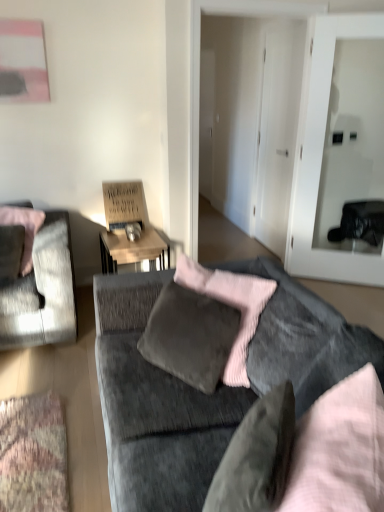
What do you see at coordinates (42, 291) in the screenshot? I see `velvet grey chair at left` at bounding box center [42, 291].

Image resolution: width=384 pixels, height=512 pixels. What do you see at coordinates (256, 457) in the screenshot?
I see `velvet gray pillow at center, which is the 1th pillow in bottom-to-top order` at bounding box center [256, 457].

I want to click on wooden desk at center, so click(x=131, y=249).

Is wooden desk at center looking in the opposite direction of velvet gray couch at center?

No, wooden desk at center is not facing the opposite direction of velvet gray couch at center.

Does point (119, 238) lie behind point (204, 411)?

Yes.

Is wooden desk at center not near velvet gray couch at center?

wooden desk at center is positioned a significant distance from velvet gray couch at center.

In the scene shown: From a real-world perspective, is wooden desk at center physically located above or below velvet gray pillow at center, acting as the first pillow starting from the right?

In terms of real-world spatial position, wooden desk at center is below velvet gray pillow at center, acting as the first pillow starting from the right.

Considering their positions, is wooden desk at center located in front of or behind velvet gray pillow at center, which is counted as the second pillow, starting from the left?

wooden desk at center is positioned farther from the viewer than velvet gray pillow at center, which is counted as the second pillow, starting from the left.

Is wooden desk at center far from velvet gray pillow at center, which is counted as the second pillow, starting from the left?

Yes.

What's the angular difference between velvet gray pillow at center, which is counted as the second pillow, starting from the left, and wooden desk at center's facing directions?

The angle between the facing direction of velvet gray pillow at center, which is counted as the second pillow, starting from the left, and the facing direction of wooden desk at center is 132 degrees.

Considering the relative sizes of velvet gray pillow at center, which appears as the second pillow when viewed from the back, and wooden desk at center in the image provided, is velvet gray pillow at center, which appears as the second pillow when viewed from the back, thinner than wooden desk at center?

Yes.

From a real-world perspective, which is physically above, velvet gray pillow at center, which is the 1th pillow in bottom-to-top order, or wooden desk at center?

In real-world perspective, velvet gray pillow at center, which is the 1th pillow in bottom-to-top order, is above.

Which is more to the left, velvet gray pillow at center, which ranks as the 1th pillow in front-to-back order, or wooden desk at center?

From the viewer's perspective, wooden desk at center appears more on the left side.

What's the angular difference between wooden desk at center and pink velvet pillow at left, arranged as the 2th pillow when viewed from the front,'s facing directions?

The angle between the facing direction of wooden desk at center and the facing direction of pink velvet pillow at left, arranged as the 2th pillow when viewed from the front, is 23.6 degrees.

From a real-world perspective, is wooden desk at center beneath pink velvet pillow at left, which ranks as the first pillow in top-to-bottom order?

Yes.

Find the location of a particular element. This screenshot has height=512, width=384. the 1st pillow in front of the wooden desk at center is located at coordinates (25, 229).

From the picture: Considering the relative positions of wooden desk at center and pink velvet pillow at left, which ranks as the first pillow in top-to-bottom order, in the image provided, is wooden desk at center to the right of pink velvet pillow at left, which ranks as the first pillow in top-to-bottom order, from the viewer's perspective?

Correct, you'll find wooden desk at center to the right of pink velvet pillow at left, which ranks as the first pillow in top-to-bottom order.

Is velvet gray pillow at center, acting as the first pillow starting from the right, oriented towards transparent glass door at center right?

No, velvet gray pillow at center, acting as the first pillow starting from the right, does not turn towards transparent glass door at center right.

How many degrees apart are the facing directions of velvet gray pillow at center, which is counted as the second pillow, starting from the left, and transparent glass door at center right?

The facing directions of velvet gray pillow at center, which is counted as the second pillow, starting from the left, and transparent glass door at center right are 97.8 degrees apart.

From a real-world perspective, is velvet gray pillow at center, acting as the first pillow starting from the right, below transparent glass door at center right?

Yes, from a real-world perspective, velvet gray pillow at center, acting as the first pillow starting from the right, is below transparent glass door at center right.

Which object is positioned more to the left, velvet gray pillow at center, acting as the first pillow starting from the right, or transparent glass door at center right?

velvet gray pillow at center, acting as the first pillow starting from the right, is more to the left.

How much distance is there between velvet gray couch at center and transparent glass door at center right?

velvet gray couch at center and transparent glass door at center right are 6.75 feet apart from each other.

Is velvet gray couch at center at the right side of transparent glass door at center right?

Incorrect, velvet gray couch at center is not on the right side of transparent glass door at center right.

Are velvet gray couch at center and transparent glass door at center right making contact?

No, velvet gray couch at center is not making contact with transparent glass door at center right.

Looking at this image, is velvet gray couch at center bigger than transparent glass door at center right?

Correct, velvet gray couch at center is larger in size than transparent glass door at center right.

From the image's perspective, which object appears higher, pink velvet pillow at left, placed as the first pillow when sorted from left to right, or velvet gray pillow at center, which ranks as the 1th pillow in front-to-back order?

pink velvet pillow at left, placed as the first pillow when sorted from left to right.

Is pink velvet pillow at left, which appears as the 2th pillow when ordered from the bottom, wider than velvet gray pillow at center, which is the 1th pillow in bottom-to-top order?

No.

From a real-world perspective, is pink velvet pillow at left, which ranks as the 1th pillow in back-to-front order, located higher than velvet gray pillow at center, acting as the first pillow starting from the right?

Result: Yes.

Is pink velvet pillow at left, which appears as the 2th pillow when ordered from the bottom, inside or outside of velvet gray pillow at center, which ranks as the 1th pillow in front-to-back order?

pink velvet pillow at left, which appears as the 2th pillow when ordered from the bottom, is not enclosed by velvet gray pillow at center, which ranks as the 1th pillow in front-to-back order.

Where is `studio couch on the right of wooden desk at center`? The height and width of the screenshot is (512, 384). studio couch on the right of wooden desk at center is located at coordinates (201, 392).

You are a GUI agent. You are given a task and a screenshot of the screen. Output one action in this format:
    pyautogui.click(x=<x>, y=<y>)
    Task: Click on the desk above the velvet gray pillow at center, acting as the first pillow starting from the right (from the image's perspective)
    
    Given the screenshot: What is the action you would take?
    pyautogui.click(x=131, y=249)

In the scene shown: Based on their spatial positions, is velvet grey chair at left or transparent glass door at center right closer to pink velvet pillow at left, which appears as the 2th pillow when ordered from the bottom?

velvet grey chair at left lies closer to pink velvet pillow at left, which appears as the 2th pillow when ordered from the bottom, than the other object.

Estimate the real-world distances between objects in this image. Which object is further from velvet grey chair at left, velvet gray couch at center or wooden desk at center?

The object further to velvet grey chair at left is velvet gray couch at center.

Which object lies further to the anchor point velvet grey chair at left, transparent glass door at center right or wooden desk at center?

The object further to velvet grey chair at left is transparent glass door at center right.

Looking at the image, which one is located closer to wooden desk at center, transparent glass door at center right or velvet grey chair at left?

The object closer to wooden desk at center is velvet grey chair at left.

Based on the photo, considering their positions, is wooden desk at center positioned further to velvet gray couch at center than transparent glass door at center right?

transparent glass door at center right is further to velvet gray couch at center.

Estimate the real-world distances between objects in this image. Which object is further from transparent glass door at center right, velvet grey chair at left or wooden desk at center?

velvet grey chair at left.

Which object lies nearer to the anchor point pink velvet pillow at left, which appears as the 2th pillow when ordered from the bottom, transparent glass door at center right or velvet gray pillow at center, which ranks as the 1th pillow in front-to-back order?

velvet gray pillow at center, which ranks as the 1th pillow in front-to-back order, is closer to pink velvet pillow at left, which appears as the 2th pillow when ordered from the bottom.

Based on the photo, which object lies nearer to the anchor point wooden desk at center, velvet gray pillow at center, which ranks as the 1th pillow in front-to-back order, or transparent glass door at center right?

Among the two, transparent glass door at center right is located nearer to wooden desk at center.

Locate an element on the screen. chair between velvet gray couch at center and wooden desk at center along the z-axis is located at coordinates (42, 291).

The width and height of the screenshot is (384, 512). What are the coordinates of `pillow between velvet gray pillow at center, acting as the first pillow starting from the right, and wooden desk at center in the front-back direction` in the screenshot? It's located at (25, 229).

Image resolution: width=384 pixels, height=512 pixels. What are the coordinates of `chair located between pink velvet pillow at left, which ranks as the first pillow in top-to-bottom order, and transparent glass door at center right in the left-right direction` in the screenshot? It's located at (42, 291).

This screenshot has height=512, width=384. What are the coordinates of `pillow between velvet gray couch at center and pink velvet pillow at left, which appears as the 2th pillow when ordered from the bottom, from front to back` in the screenshot? It's located at (256, 457).